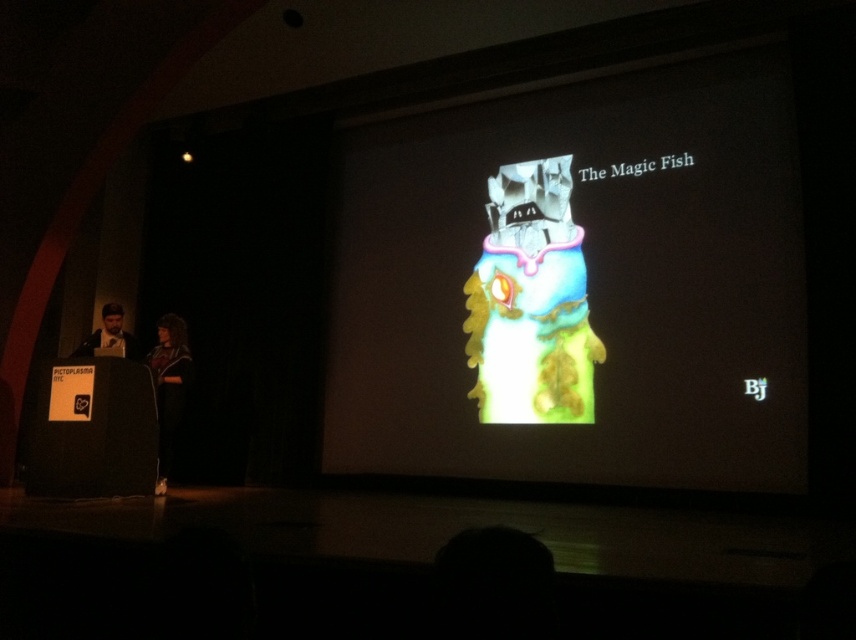
Question: Can you confirm if shiny metallic fish at center is positioned to the right of black fabric at left?

Choices:
 (A) no
 (B) yes

Answer: (B)

Question: Does shiny metallic fish at center appear on the right side of black fabric at left?

Choices:
 (A) yes
 (B) no

Answer: (A)

Question: Which object is positioned closest to the shiny metallic fish at center?

Choices:
 (A) black fabric at left
 (B) black cardboard speaker at lower left

Answer: (A)

Question: Which point appears closest to the camera in this image?

Choices:
 (A) (592, 374)
 (B) (93, 339)
 (C) (36, 413)
 (D) (171, 360)

Answer: (C)

Question: Can you confirm if black cardboard speaker at lower left is positioned above matte black laptop at left?

Choices:
 (A) yes
 (B) no

Answer: (B)

Question: Which point appears closest to the camera in this image?

Choices:
 (A) (170, 412)
 (B) (105, 304)
 (C) (152, 388)

Answer: (C)